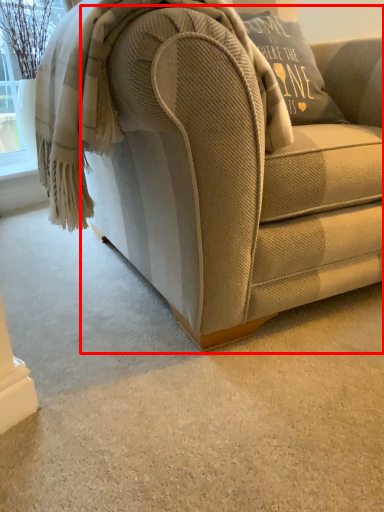
Question: From the image's perspective, what is the correct spatial positioning of studio couch (annotated by the red box) in reference to blanket?

Choices:
 (A) above
 (B) below

Answer: (A)